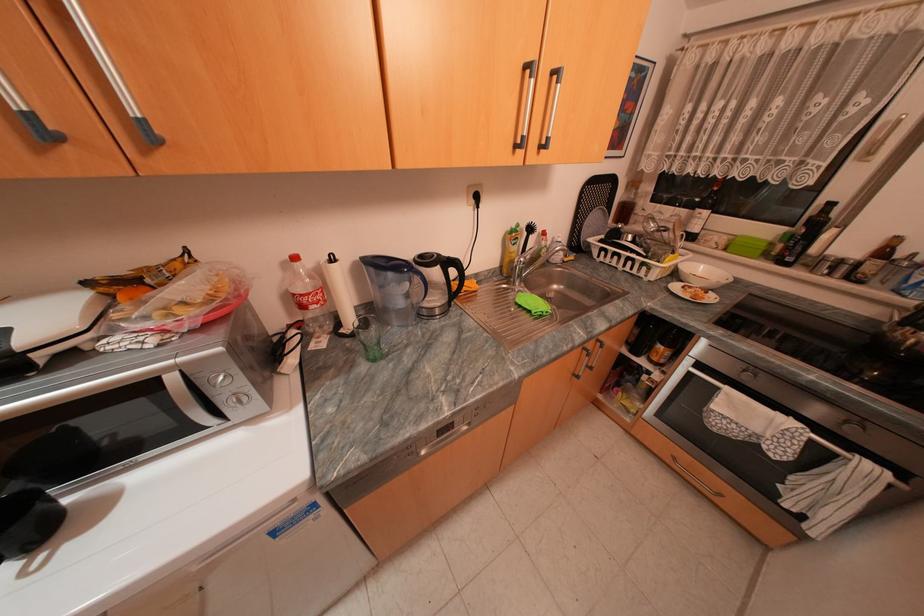
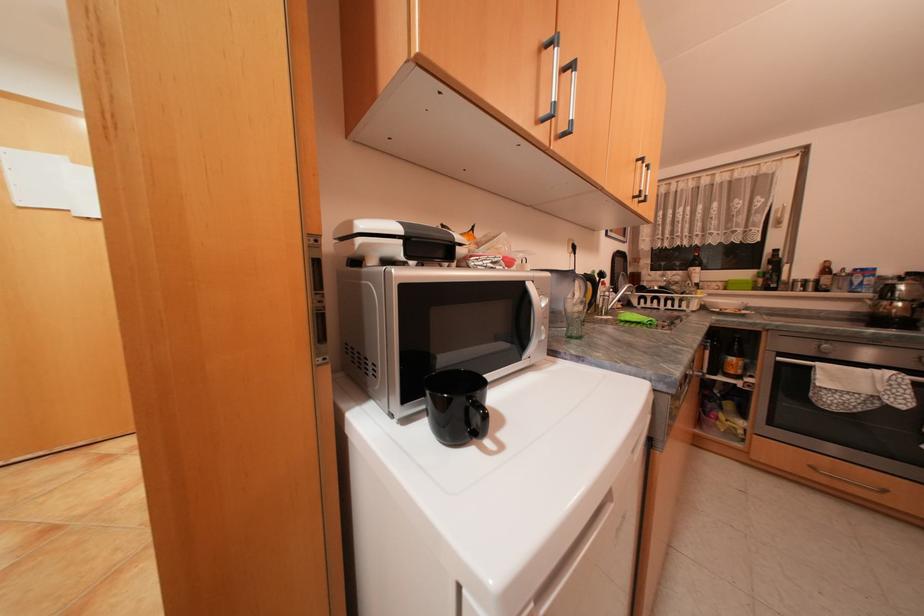
Find the pixel in the second image that matches (796,248) in the first image.

(776, 280)